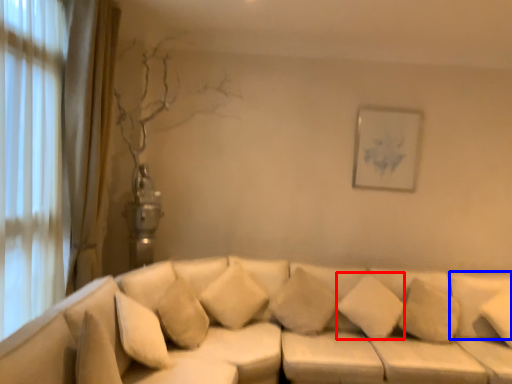
Question: Among these objects, which one is farthest to the camera, pillow (highlighted by a red box) or pillow (highlighted by a blue box)?

Choices:
 (A) pillow
 (B) pillow

Answer: (A)